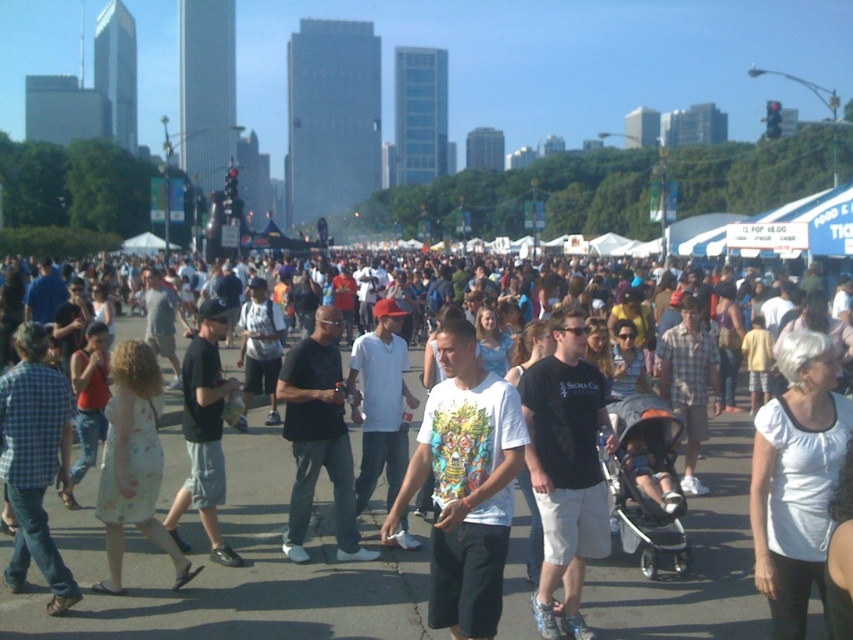
You are standing at the origin point in the image. You see two points labeled as point 1 at coordinates point [283,516] and point 2 at coordinates point [447,614]. Which point is closer to you?

Point 1 at coordinates point [283,516] is closer to you because it is in front of point 2 at coordinates point [447,614].